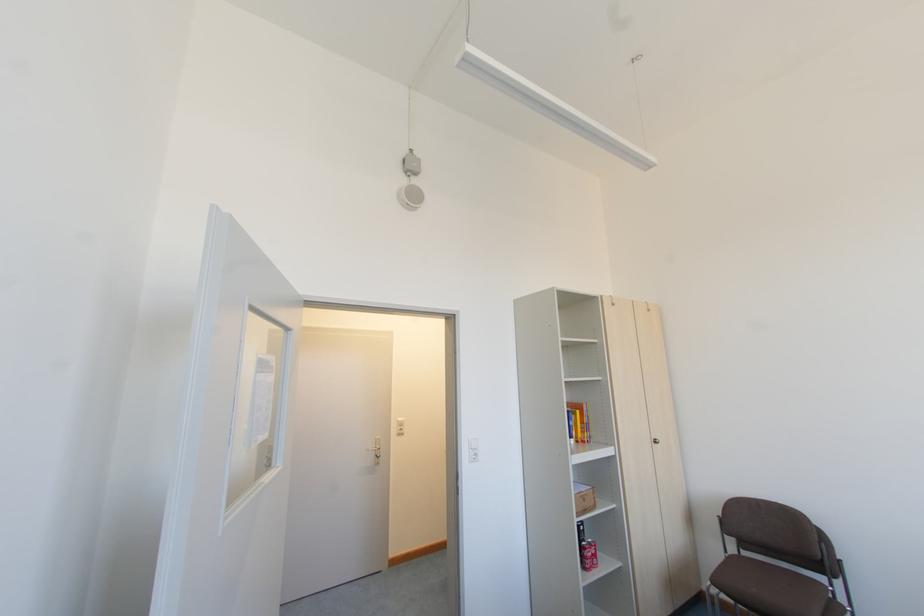
Identify the location of chair sitting surface. (774, 591).